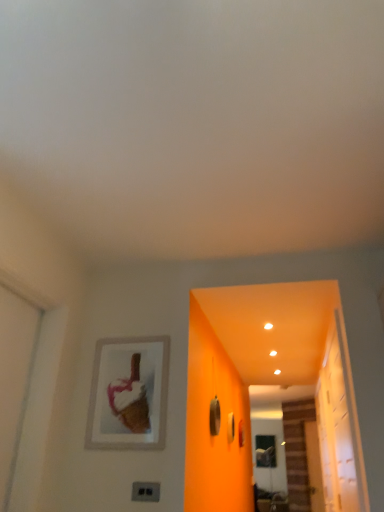
In order to face black plastic electric outlet at lower center, should I rotate leftwards or rightwards?

Turn left approximately 6.294 degrees to face it.

The width and height of the screenshot is (384, 512). I want to click on transparent glass screen door at lower right, so click(269, 457).

Considering the relative sizes of transparent glass door at right and matte silver picture frame at upper left in the image provided, is transparent glass door at right wider than matte silver picture frame at upper left?

Correct, the width of transparent glass door at right exceeds that of matte silver picture frame at upper left.

Considering the positions of objects transparent glass door at right and matte silver picture frame at upper left in the image provided, who is more to the right, transparent glass door at right or matte silver picture frame at upper left?

transparent glass door at right is more to the right.

Are transparent glass door at right and matte silver picture frame at upper left making contact?

transparent glass door at right is not next to matte silver picture frame at upper left, and they're not touching.

Which object is closer to the camera taking this photo, transparent glass door at right or transparent glass screen door at lower right?

transparent glass door at right is closer to the camera.

From the image's perspective, is transparent glass door at right located above or below transparent glass screen door at lower right?

Based on their image positions, transparent glass door at right is located above transparent glass screen door at lower right.

Based on the photo, considering the relative sizes of transparent glass door at right and transparent glass screen door at lower right in the image provided, is transparent glass door at right shorter than transparent glass screen door at lower right?

Indeed, transparent glass door at right has a lesser height compared to transparent glass screen door at lower right.

Is transparent glass door at right facing away from transparent glass screen door at lower right?

No, transparent glass door at right is not facing the opposite direction of transparent glass screen door at lower right.

Is matte silver picture frame at upper left to the right of transparent glass door at right from the viewer's perspective?

No, matte silver picture frame at upper left is not to the right of transparent glass door at right.

Can you confirm if matte silver picture frame at upper left is shorter than transparent glass door at right?

Indeed, matte silver picture frame at upper left has a lesser height compared to transparent glass door at right.

Consider the image. Does matte silver picture frame at upper left have a greater width compared to transparent glass door at right?

No, matte silver picture frame at upper left is not wider than transparent glass door at right.

Consider the image. Does transparent glass screen door at lower right have a smaller size compared to black plastic electric outlet at lower center?

Incorrect, transparent glass screen door at lower right is not smaller in size than black plastic electric outlet at lower center.

From the image's perspective, is transparent glass screen door at lower right under black plastic electric outlet at lower center?

Indeed, from the image's perspective, transparent glass screen door at lower right is shown beneath black plastic electric outlet at lower center.

Looking at this image, who is taller, transparent glass screen door at lower right or black plastic electric outlet at lower center?

transparent glass screen door at lower right is taller.

The image size is (384, 512). I want to click on electric outlet lying in front of the transparent glass screen door at lower right, so click(x=145, y=490).

Between black plastic electric outlet at lower center and transparent glass screen door at lower right, which one has smaller size?

black plastic electric outlet at lower center.

In the scene shown: Which object is closer to the camera, black plastic electric outlet at lower center or transparent glass screen door at lower right?

black plastic electric outlet at lower center is in front.

Is black plastic electric outlet at lower center far away from transparent glass screen door at lower right?

That's right, there is a large distance between black plastic electric outlet at lower center and transparent glass screen door at lower right.

Which is behind, point (141, 487) or point (256, 419)?

Point (256, 419)

Where is `electric outlet located on the left of transparent glass door at right`? The height and width of the screenshot is (512, 384). electric outlet located on the left of transparent glass door at right is located at coordinates (145, 490).

Is point (357, 488) positioned in front of point (150, 498)?

That is False.

Who is smaller, transparent glass door at right or black plastic electric outlet at lower center?

black plastic electric outlet at lower center is smaller.

Is transparent glass door at right oriented away from black plastic electric outlet at lower center?

No, transparent glass door at right's orientation is not away from black plastic electric outlet at lower center.

From the image's perspective, which is above, black plastic electric outlet at lower center or matte silver picture frame at upper left?

matte silver picture frame at upper left, from the image's perspective.

Find the location of a particular element. picture frame behind the black plastic electric outlet at lower center is located at coordinates (128, 394).

Is black plastic electric outlet at lower center far from matte silver picture frame at upper left?

No.

Identify the location of glass door in front of the matte silver picture frame at upper left. (337, 429).

Find the location of a particular element. The height and width of the screenshot is (512, 384). screen door that is on the right side of transparent glass door at right is located at coordinates (269, 457).

Looking at the image, which one is located further to matte silver picture frame at upper left, transparent glass screen door at lower right or transparent glass door at right?

The object further to matte silver picture frame at upper left is transparent glass screen door at lower right.

From the image, which object appears to be farther from black plastic electric outlet at lower center, transparent glass screen door at lower right or matte silver picture frame at upper left?

transparent glass screen door at lower right lies further to black plastic electric outlet at lower center than the other object.

Looking at the image, which one is located closer to transparent glass door at right, black plastic electric outlet at lower center or matte silver picture frame at upper left?

matte silver picture frame at upper left.

Looking at the image, which one is located closer to transparent glass screen door at lower right, black plastic electric outlet at lower center or transparent glass door at right?

Among the two, transparent glass door at right is located nearer to transparent glass screen door at lower right.

From the image, which object appears to be nearer to transparent glass door at right, transparent glass screen door at lower right or black plastic electric outlet at lower center?

Among the two, black plastic electric outlet at lower center is located nearer to transparent glass door at right.

Looking at the image, which one is located further to transparent glass door at right, black plastic electric outlet at lower center or transparent glass screen door at lower right?

transparent glass screen door at lower right is further to transparent glass door at right.

Estimate the real-world distances between objects in this image. Which object is closer to transparent glass screen door at lower right, transparent glass door at right or matte silver picture frame at upper left?

Among the two, transparent glass door at right is located nearer to transparent glass screen door at lower right.

Looking at the image, which one is located further to black plastic electric outlet at lower center, matte silver picture frame at upper left or transparent glass screen door at lower right?

transparent glass screen door at lower right is further to black plastic electric outlet at lower center.

Where is `picture frame located between transparent glass door at right and transparent glass screen door at lower right in the depth direction`? This screenshot has height=512, width=384. picture frame located between transparent glass door at right and transparent glass screen door at lower right in the depth direction is located at coordinates (128, 394).

Identify the location of electric outlet between transparent glass door at right and transparent glass screen door at lower right in the front-back direction. The width and height of the screenshot is (384, 512). (145, 490).

The width and height of the screenshot is (384, 512). What are the coordinates of `electric outlet between matte silver picture frame at upper left and transparent glass door at right` in the screenshot? It's located at (145, 490).

Image resolution: width=384 pixels, height=512 pixels. Identify the location of picture frame positioned between black plastic electric outlet at lower center and transparent glass screen door at lower right from near to far. (128, 394).